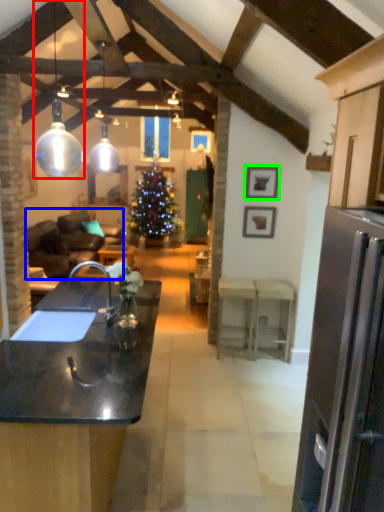
Question: Considering the real-world distances, which object is farthest from lamp (highlighted by a red box)? studio couch (highlighted by a blue box) or picture frame (highlighted by a green box)?

Choices:
 (A) studio couch
 (B) picture frame

Answer: (B)